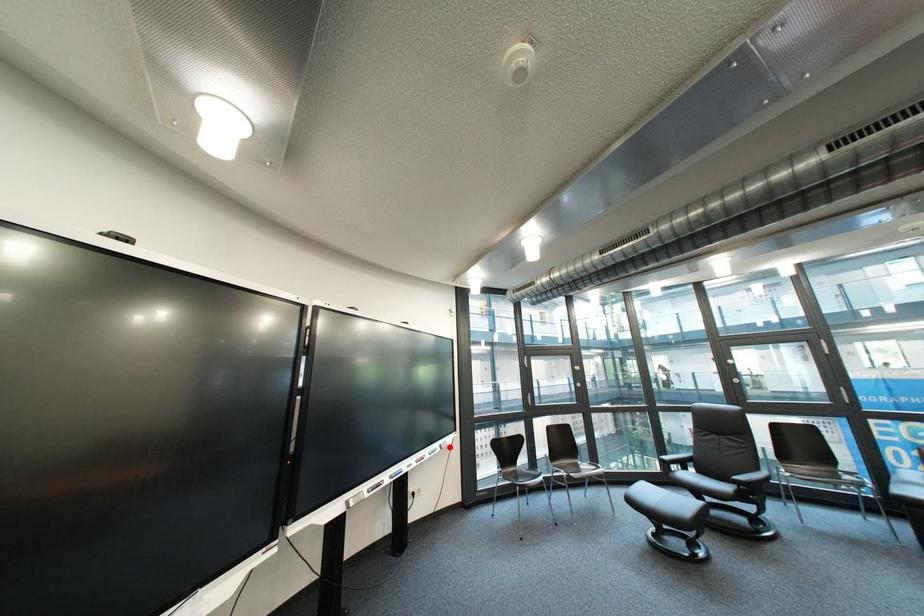
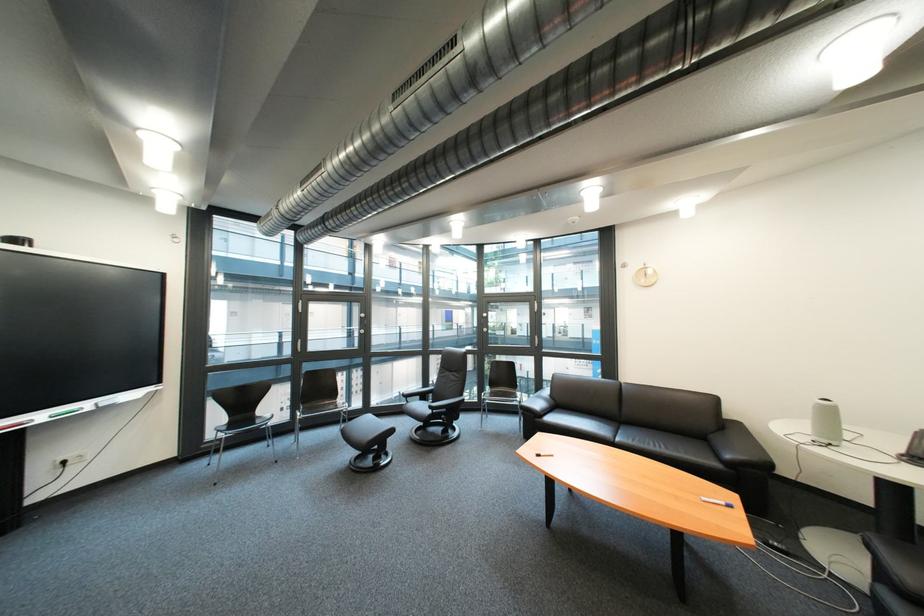
The point at the highlighted location is marked in the first image. Where is the corresponding point in the second image?

(101, 406)